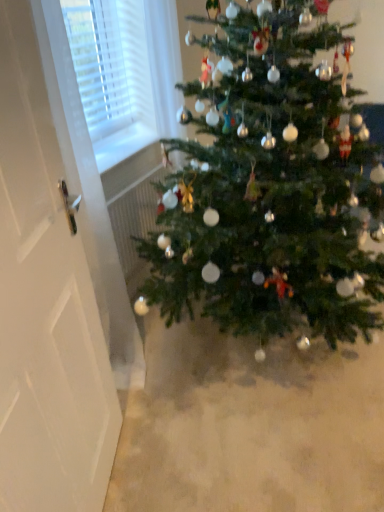
The height and width of the screenshot is (512, 384). What do you see at coordinates (45, 306) in the screenshot?
I see `white glossy door at left` at bounding box center [45, 306].

I want to click on white glossy door at left, so click(45, 306).

This screenshot has height=512, width=384. Identify the location of green matte christmas tree at center. (270, 186).

This screenshot has width=384, height=512. What do you see at coordinates (270, 186) in the screenshot?
I see `green matte christmas tree at center` at bounding box center [270, 186].

In order to click on white glossy door at left in this screenshot , I will do click(45, 306).

Considering the relative positions of green matte christmas tree at center and white glossy door at left in the image provided, is green matte christmas tree at center to the right of white glossy door at left from the viewer's perspective?

Yes, green matte christmas tree at center is to the right of white glossy door at left.

Based on the photo, is the position of green matte christmas tree at center less distant than that of white glossy door at left?

No.

Which is less distant, (306, 166) or (92, 402)?

The point (92, 402) is in front.

From the image's perspective, which one is positioned higher, green matte christmas tree at center or white glossy door at left?

green matte christmas tree at center appears higher in the image.

From a real-world perspective, who is located lower, green matte christmas tree at center or white glossy door at left?

green matte christmas tree at center is physically lower.

Between green matte christmas tree at center and white glossy door at left, which one has larger width?

green matte christmas tree at center.

From their relative heights in the image, would you say green matte christmas tree at center is taller or shorter than white glossy door at left?

green matte christmas tree at center is shorter than white glossy door at left.

Considering the relative sizes of green matte christmas tree at center and white glossy door at left in the image provided, is green matte christmas tree at center smaller than white glossy door at left?

No.

Is green matte christmas tree at center completely or partially outside of white glossy door at left?

green matte christmas tree at center is positioned outside white glossy door at left.

Based on the photo, is there a large distance between green matte christmas tree at center and white glossy door at left?

They are positioned close to each other.

Is green matte christmas tree at center looking in the opposite direction of white glossy door at left?

No, green matte christmas tree at center is not facing the opposite direction of white glossy door at left.

There is a green matte christmas tree at center. Where is `screen door above it (from a real-world perspective)`? This screenshot has width=384, height=512. screen door above it (from a real-world perspective) is located at coordinates (45, 306).

Which is more to the left, white glossy door at left or green matte christmas tree at center?

white glossy door at left is more to the left.

Is white glossy door at left positioned in front of green matte christmas tree at center?

A: Yes, it is.

Is point (98, 482) closer or farther from the camera than point (293, 143)?

Point (98, 482) is positioned closer to the camera compared to point (293, 143).

From the image's perspective, which object appears higher, white glossy door at left or green matte christmas tree at center?

green matte christmas tree at center.

From a real-world perspective, between white glossy door at left and green matte christmas tree at center, who is vertically higher?

white glossy door at left.

In terms of width, does white glossy door at left look wider or thinner when compared to green matte christmas tree at center?

In the image, white glossy door at left appears to be more narrow than green matte christmas tree at center.

From the picture: Who is shorter, white glossy door at left or green matte christmas tree at center?

green matte christmas tree at center.

Between white glossy door at left and green matte christmas tree at center, which one has larger size?

Bigger between the two is green matte christmas tree at center.

Is green matte christmas tree at center located within white glossy door at left?

Actually, green matte christmas tree at center is outside white glossy door at left.

Is the surface of white glossy door at left in direct contact with green matte christmas tree at center?

No, white glossy door at left is not with green matte christmas tree at center.

Consider the image. Is white glossy door at left turned away from green matte christmas tree at center?

No.

How different are the orientations of white glossy door at left and green matte christmas tree at center in degrees?

The angular difference between white glossy door at left and green matte christmas tree at center is 21.2 degrees.

Identify the location of screen door located on the left of green matte christmas tree at center. This screenshot has height=512, width=384. (45, 306).

Where is `screen door that is below the green matte christmas tree at center (from the image's perspective)`? Image resolution: width=384 pixels, height=512 pixels. screen door that is below the green matte christmas tree at center (from the image's perspective) is located at coordinates (45, 306).

Where is `christmas tree that appears on the right of white glossy door at left`? christmas tree that appears on the right of white glossy door at left is located at coordinates pyautogui.click(x=270, y=186).